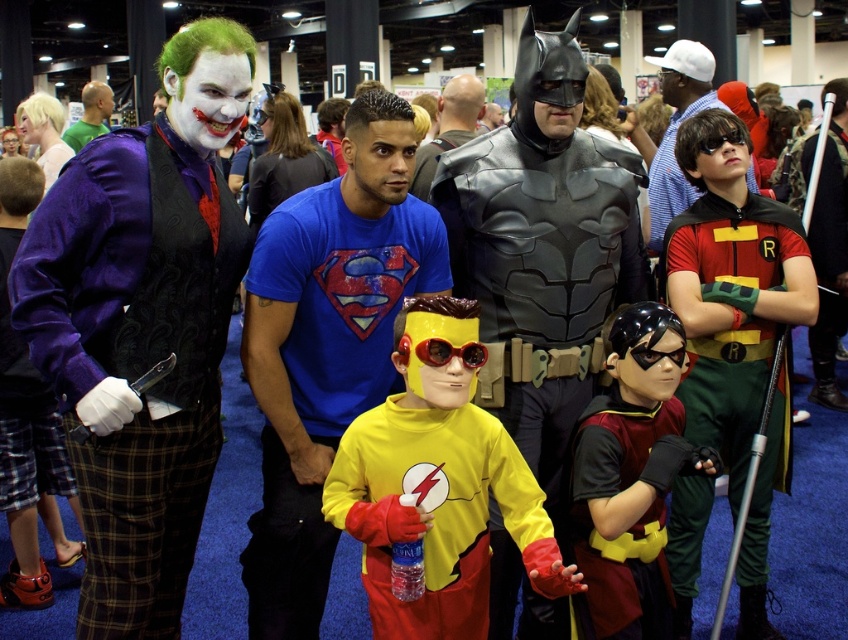
Based on the coordinates provided, which object is located at point [327,346]?

The blue t shirt at center is located at point [327,346] according to the coordinates provided.